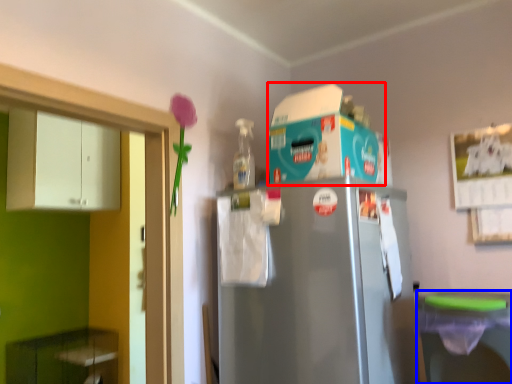
Question: Among these objects, which one is nearest to the camera, appliance (highlighted by a red box) or dish washer (highlighted by a blue box)?

Choices:
 (A) appliance
 (B) dish washer

Answer: (B)